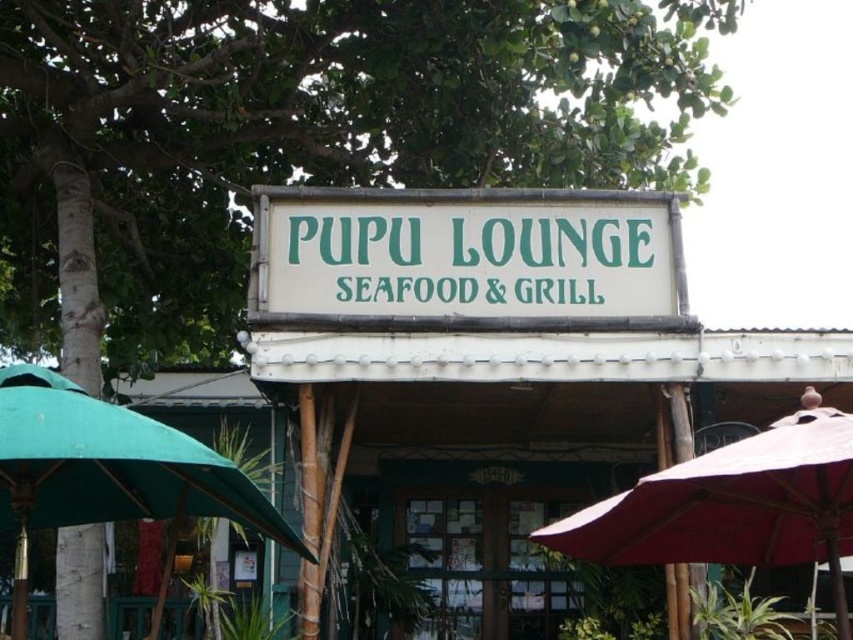
This screenshot has width=853, height=640. What do you see at coordinates (467, 256) in the screenshot?
I see `white bamboo sign at center` at bounding box center [467, 256].

Does white bamboo sign at center appear under green fabric umbrella at left?

Incorrect, white bamboo sign at center is not positioned below green fabric umbrella at left.

Who is more forward, (514, 248) or (294, 547)?

Point (294, 547) is in front.

This screenshot has height=640, width=853. What are the coordinates of `white bamboo sign at center` in the screenshot? It's located at (467, 256).

From the picture: Is matte red umbrella at lower right to the right of green fabric umbrella at left from the viewer's perspective?

Correct, you'll find matte red umbrella at lower right to the right of green fabric umbrella at left.

Which is behind, point (715, 548) or point (55, 499)?

The point (715, 548) is behind.

Who is more forward, (x=610, y=515) or (x=213, y=464)?

Point (x=213, y=464) is in front.

Locate an element on the screen. matte red umbrella at lower right is located at coordinates [733, 504].

Can you confirm if white bamboo sign at center is wider than matte red umbrella at lower right?

Yes.

Which is in front, point (532, 268) or point (809, 410)?

Positioned in front is point (809, 410).

Locate an element on the screen. white bamboo sign at center is located at coordinates (467, 256).